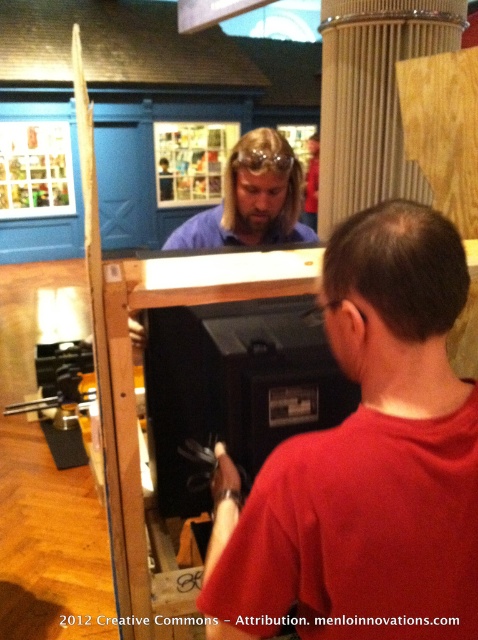
You are an artist trying to paint the scene in front of the large mirror. You notice two shirts displayed at the center of the mirror reflection. Which shirt, the red matte shirt at center or the blue matte shirt at center, appears taller in the reflection?

The red matte shirt at center appears taller than the blue matte shirt at center in the reflection.

You are an assistant helping with an exhibit setup. You need to place two shirts on a display mannequin. The mannequin has a limited space for the torso area. Given the red matte shirt at center and the blue matte shirt at center, which shirt would you choose to ensure it fits better in the narrower torso space?

The red matte shirt at center has a lesser width compared to the blue matte shirt at center, so it would fit better in the narrower torso space.

Where is the blue matte shirt at center located in the image?

The blue matte shirt at center is located at point coordinates of 0.312 on the x axis and 0.527 on the y axis.